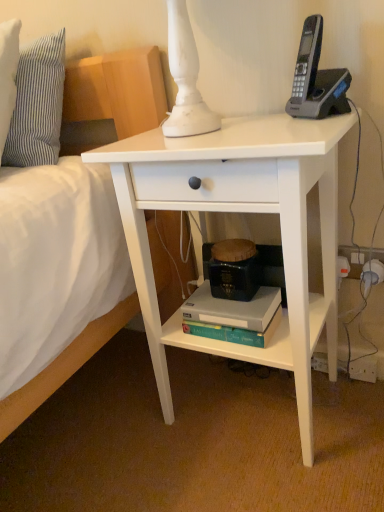
Locate an element on the screen. vacant space situated on the left part of white matte desk at center is located at coordinates (108, 424).